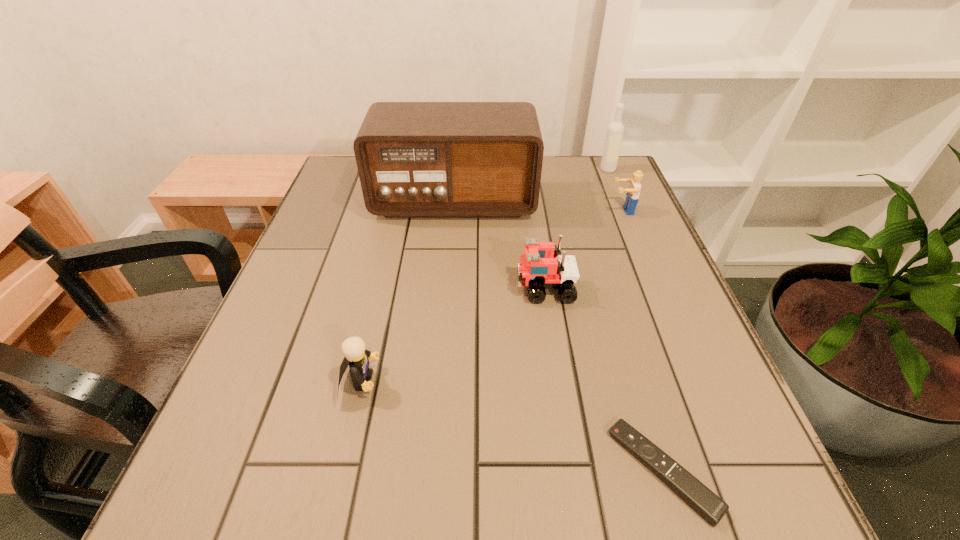
You are a GUI agent. You are given a task and a screenshot of the screen. Output one action in this format:
    pyautogui.click(x=<x>, y=<y>)
    Task: Click on the unoccupied position between the rightmost Lego and the radio receiver
    
    Given the screenshot: What is the action you would take?
    pyautogui.click(x=538, y=206)

The width and height of the screenshot is (960, 540). I want to click on unoccupied area between the farthest Lego and the nearest Lego, so click(x=492, y=296).

Find the location of a particular element. The image size is (960, 540). vacant area that lies between the tallest object and the second Lego from left to right is located at coordinates (499, 245).

This screenshot has width=960, height=540. Find the location of `free space that is in between the radio receiver and the fourth farthest object`. free space that is in between the radio receiver and the fourth farthest object is located at coordinates (499, 245).

Identify the location of the fifth closest object to the fifth shortest object. The image size is (960, 540). (357, 357).

You are a GUI agent. You are given a task and a screenshot of the screen. Output one action in this format:
    pyautogui.click(x=<x>, y=<y>)
    Task: Click on the object that stands as the fifth closest to the vodka
    
    Given the screenshot: What is the action you would take?
    pyautogui.click(x=357, y=357)

Identify which Lego is the second nearest to the nearest Lego. Please provide its 2D coordinates. Your answer should be formatted as a tuple, i.e. [(x, y)], where the tuple contains the x and y coordinates of a point satisfying the conditions above.

[(632, 196)]

Identify which Lego is the closest to the shortest object. Please provide its 2D coordinates. Your answer should be formatted as a tuple, i.e. [(x, y)], where the tuple contains the x and y coordinates of a point satisfying the conditions above.

[(536, 272)]

Locate an element on the screen. This screenshot has width=960, height=540. blank area in the image that satisfies the following two spatial constraints: 1. on the front-facing side of the tallest object; 2. on the left side of the nearest object is located at coordinates (433, 470).

Find the location of a particular element. This screenshot has width=960, height=540. vacant area that satisfies the following two spatial constraints: 1. on the back side of the nearest object; 2. on the front-facing side of the second Lego from right to left is located at coordinates (608, 288).